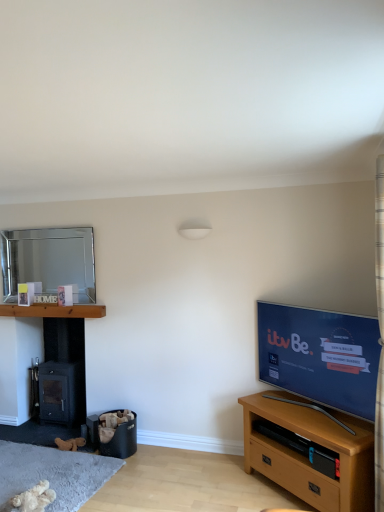
The height and width of the screenshot is (512, 384). Identify the location of vacant area to the right of black plastic trash bin at lower left. (161, 454).